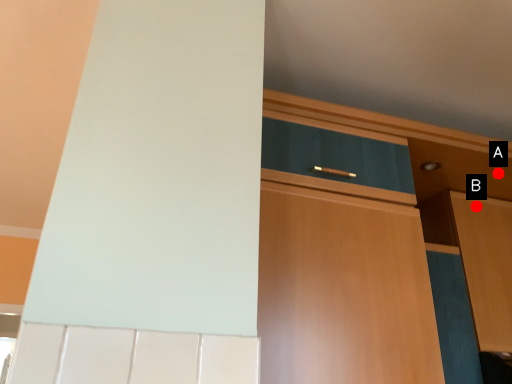
Question: Two points are circled on the image, labeled by A and B beside each circle. Which point is further to the camera?

Choices:
 (A) A is further
 (B) B is further

Answer: (B)